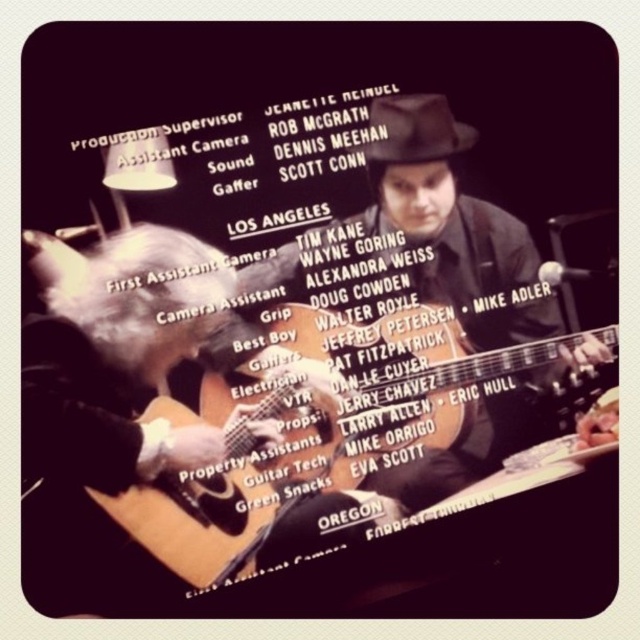
Question: Does matte black guitar at center have a larger size compared to acoustic wood guitar at center?

Choices:
 (A) no
 (B) yes

Answer: (A)

Question: Which point appears farthest from the camera in this image?

Choices:
 (A) (604, 344)
 (B) (163, 529)

Answer: (A)

Question: Can you confirm if matte black guitar at center is wider than acoustic wood guitar at center?

Choices:
 (A) yes
 (B) no

Answer: (B)

Question: Among these objects, which one is farthest from the camera?

Choices:
 (A) acoustic wood guitar at center
 (B) matte black guitar at center

Answer: (B)

Question: Does matte black guitar at center have a smaller size compared to acoustic wood guitar at center?

Choices:
 (A) no
 (B) yes

Answer: (B)